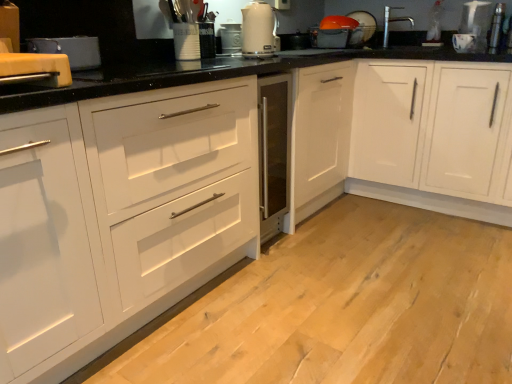
The image size is (512, 384). What are the coordinates of `white matte cabinet at center, the second cabinetry from the right` in the screenshot? It's located at (118, 216).

How much space does metallic silver toaster at center, placed as the third appliance when sorted from top to bottom, occupy horizontally?

metallic silver toaster at center, placed as the third appliance when sorted from top to bottom, is 3.46 inches in width.

How much space does matte black toaster at upper left, which is the 1th appliance from bottom to top, occupy horizontally?

9.72 inches.

Locate an element on the screen. matte black toaster at upper left, placed as the fourth appliance when sorted from right to left is located at coordinates (70, 50).

I want to click on matte white dish drainer at upper right, which appears as the fourth appliance when ordered from the bottom, so click(x=362, y=27).

Identify the location of silver metallic faucet at upper right. (392, 21).

Considering the sizes of objects white glossy cabinet at center, which is counted as the second cabinetry, starting from the left, and matte white dish drainer at upper right, which is the 1th appliance in back-to-front order, in the image provided, who is bigger, white glossy cabinet at center, which is counted as the second cabinetry, starting from the left, or matte white dish drainer at upper right, which is the 1th appliance in back-to-front order,?

white glossy cabinet at center, which is counted as the second cabinetry, starting from the left.

From a real-world perspective, is white glossy cabinet at center, which appears as the first cabinetry when viewed from the right, located higher than matte white dish drainer at upper right, the third appliance from the left?

No, from a real-world perspective, white glossy cabinet at center, which appears as the first cabinetry when viewed from the right, is not on top of matte white dish drainer at upper right, the third appliance from the left.

Is white glossy cabinet at center, which is counted as the second cabinetry, starting from the left, directly adjacent to matte white dish drainer at upper right, arranged as the second appliance when viewed from the right?

No, white glossy cabinet at center, which is counted as the second cabinetry, starting from the left, is not touching matte white dish drainer at upper right, arranged as the second appliance when viewed from the right.

Which of these two, white glossy cabinet at center, which is counted as the second cabinetry, starting from the left, or white matte cabinet at center, arranged as the first cabinetry when viewed from the left, stands taller?

white glossy cabinet at center, which is counted as the second cabinetry, starting from the left.

Considering the positions of objects white glossy cabinet at center, which is counted as the second cabinetry, starting from the left, and white matte cabinet at center, arranged as the first cabinetry when viewed from the left, in the image provided, who is more to the right, white glossy cabinet at center, which is counted as the second cabinetry, starting from the left, or white matte cabinet at center, arranged as the first cabinetry when viewed from the left,?

Positioned to the right is white glossy cabinet at center, which is counted as the second cabinetry, starting from the left.

Is white glossy cabinet at center, which is counted as the second cabinetry, starting from the left, positioned beyond the bounds of white matte cabinet at center, the second cabinetry from the right?

white glossy cabinet at center, which is counted as the second cabinetry, starting from the left, is positioned outside white matte cabinet at center, the second cabinetry from the right.

At what (x,y) coordinates should I click in order to perform the action: click on cabinetry located behind the white matte cabinet at center, arranged as the first cabinetry when viewed from the left. Please return your answer as a coordinate pair (x, y). Looking at the image, I should click on (434, 127).

Which of these two, matte black toaster at upper left, placed as the fourth appliance when sorted from right to left, or silver metallic faucet at upper right, is bigger?

silver metallic faucet at upper right.

Looking at this image, is matte black toaster at upper left, which is the 1th appliance from bottom to top, directly adjacent to silver metallic faucet at upper right?

matte black toaster at upper left, which is the 1th appliance from bottom to top, and silver metallic faucet at upper right are not in contact.

Which point is more forward, (x=90, y=63) or (x=388, y=38)?

The point (x=90, y=63) is in front.

Is matte black toaster at upper left, which is the 1th appliance from bottom to top, shorter than silver metallic faucet at upper right?

Indeed, matte black toaster at upper left, which is the 1th appliance from bottom to top, has a lesser height compared to silver metallic faucet at upper right.

Is white matte cabinet at center, the second cabinetry from the right, facing away from white glossy cabinet at center, which appears as the first cabinetry when viewed from the right?

No, white glossy cabinet at center, which appears as the first cabinetry when viewed from the right, is not at the back of white matte cabinet at center, the second cabinetry from the right.

Which of these two, white matte cabinet at center, arranged as the first cabinetry when viewed from the left, or white glossy cabinet at center, which appears as the first cabinetry when viewed from the right, is bigger?

white matte cabinet at center, arranged as the first cabinetry when viewed from the left.

Which is more to the left, white matte cabinet at center, arranged as the first cabinetry when viewed from the left, or white glossy cabinet at center, which appears as the first cabinetry when viewed from the right?

white matte cabinet at center, arranged as the first cabinetry when viewed from the left.

Is there a large distance between white matte cabinet at center, arranged as the first cabinetry when viewed from the left, and white glossy cabinet at center, which appears as the first cabinetry when viewed from the right?

white matte cabinet at center, arranged as the first cabinetry when viewed from the left, is positioned a significant distance from white glossy cabinet at center, which appears as the first cabinetry when viewed from the right.

Is matte white dish drainer at upper right, arranged as the second appliance when viewed from the right, beside metallic silver toaster at center, placed as the third appliance when sorted from top to bottom?

No, matte white dish drainer at upper right, arranged as the second appliance when viewed from the right, is not with metallic silver toaster at center, placed as the third appliance when sorted from top to bottom.

Is matte white dish drainer at upper right, placed as the 1th appliance when sorted from top to bottom, outside of metallic silver toaster at center, which is the 2th appliance in left-to-right order?

Yes, matte white dish drainer at upper right, placed as the 1th appliance when sorted from top to bottom, is located beyond the bounds of metallic silver toaster at center, which is the 2th appliance in left-to-right order.

Based on their positions, is matte white dish drainer at upper right, which appears as the fourth appliance when ordered from the bottom, located to the left or right of metallic silver toaster at center, which is the 2th appliance in left-to-right order?

matte white dish drainer at upper right, which appears as the fourth appliance when ordered from the bottom, is to the right of metallic silver toaster at center, which is the 2th appliance in left-to-right order.

Considering the relative sizes of matte white dish drainer at upper right, which appears as the 4th appliance when viewed from the front, and metallic silver toaster at center, which ranks as the second appliance in bottom-to-top order, in the image provided, is matte white dish drainer at upper right, which appears as the 4th appliance when viewed from the front, thinner than metallic silver toaster at center, which ranks as the second appliance in bottom-to-top order,?

Indeed, matte white dish drainer at upper right, which appears as the 4th appliance when viewed from the front, has a lesser width compared to metallic silver toaster at center, which ranks as the second appliance in bottom-to-top order.

Between white matte cabinet at center, the second cabinetry from the right, and metallic silver toaster at center, the 2th appliance viewed from the front, which one has less height?

metallic silver toaster at center, the 2th appliance viewed from the front, is shorter.

Would you say white matte cabinet at center, the second cabinetry from the right, is outside metallic silver toaster at center, placed as the third appliance when sorted from top to bottom?

white matte cabinet at center, the second cabinetry from the right, lies outside metallic silver toaster at center, placed as the third appliance when sorted from top to bottom,'s area.

Based on the photo, is the surface of white matte cabinet at center, arranged as the first cabinetry when viewed from the left, in direct contact with metallic silver toaster at center, the 2th appliance viewed from the front?

They are not placed beside each other.

From a real-world perspective, is matte white dish drainer at upper right, which appears as the 4th appliance when viewed from the front, physically below white matte cabinet at center, the second cabinetry from the right?

No, from a real-world perspective, matte white dish drainer at upper right, which appears as the 4th appliance when viewed from the front, is not below white matte cabinet at center, the second cabinetry from the right.

Considering the relative positions of matte white dish drainer at upper right, which is the 1th appliance in back-to-front order, and white matte cabinet at center, the second cabinetry from the right, in the image provided, is matte white dish drainer at upper right, which is the 1th appliance in back-to-front order, behind white matte cabinet at center, the second cabinetry from the right,?

Yes, it is behind white matte cabinet at center, the second cabinetry from the right.

Between matte white dish drainer at upper right, which appears as the 4th appliance when viewed from the front, and white matte cabinet at center, arranged as the first cabinetry when viewed from the left, which one has larger size?

Bigger between the two is white matte cabinet at center, arranged as the first cabinetry when viewed from the left.

Is matte white dish drainer at upper right, arranged as the second appliance when viewed from the right, not inside white matte cabinet at center, the second cabinetry from the right?

matte white dish drainer at upper right, arranged as the second appliance when viewed from the right, lies outside white matte cabinet at center, the second cabinetry from the right,'s area.

From the image's perspective, count 4th appliances upward from the white glossy cabinet at center, which appears as the first cabinetry when viewed from the right, and point to it. Please provide its 2D coordinates.

[(362, 27)]

At what (x,y) coordinates should I click in order to perform the action: click on cabinetry on the right side of white matte cabinet at center, the second cabinetry from the right. Please return your answer as a coordinate pair (x, y). Looking at the image, I should click on (434, 127).

Estimate the real-world distances between objects in this image. Which object is closer to matte black toaster at upper left, which is the 1th appliance from bottom to top, matte white dish drainer at upper right, which appears as the 4th appliance when viewed from the front, or white glossy cabinet at center, which is counted as the second cabinetry, starting from the left?

white glossy cabinet at center, which is counted as the second cabinetry, starting from the left.

When comparing their distances from silver metallic faucet at upper right, does white matte cabinet at center, arranged as the first cabinetry when viewed from the left, or white glossy electric kettle at upper center seem further?

white matte cabinet at center, arranged as the first cabinetry when viewed from the left, is further to silver metallic faucet at upper right.

Considering their positions, is white glossy cabinet at center, which appears as the first cabinetry when viewed from the right, positioned further to white matte cabinet at center, arranged as the first cabinetry when viewed from the left, than metallic silver toaster at upper right, the 2th appliance when ordered from back to front?

metallic silver toaster at upper right, the 2th appliance when ordered from back to front, is positioned further to the anchor white matte cabinet at center, arranged as the first cabinetry when viewed from the left.

When comparing their distances from metallic silver toaster at upper right, arranged as the 2th appliance when viewed from the top, does white matte cabinet at center, the second cabinetry from the right, or white glossy cabinet at center, which is counted as the second cabinetry, starting from the left, seem closer?

white glossy cabinet at center, which is counted as the second cabinetry, starting from the left, lies closer to metallic silver toaster at upper right, arranged as the 2th appliance when viewed from the top, than the other object.

Estimate the real-world distances between objects in this image. Which object is further from white matte cabinet at center, arranged as the first cabinetry when viewed from the left, metallic silver toaster at upper right, arranged as the 2th appliance when viewed from the top, or white glossy cabinet at center, which is counted as the second cabinetry, starting from the left?

The object further to white matte cabinet at center, arranged as the first cabinetry when viewed from the left, is metallic silver toaster at upper right, arranged as the 2th appliance when viewed from the top.

When comparing their distances from white glossy electric kettle at upper center, does metallic silver toaster at center, which is counted as the third appliance, starting from the back, or white glossy cabinet at center, which appears as the first cabinetry when viewed from the right, seem closer?

Among the two, metallic silver toaster at center, which is counted as the third appliance, starting from the back, is located nearer to white glossy electric kettle at upper center.

Considering their positions, is white glossy electric kettle at upper center positioned closer to metallic silver toaster at center, which is counted as the third appliance, starting from the back, than metallic silver toaster at upper right, which appears as the first appliance when viewed from the right?

Based on the image, white glossy electric kettle at upper center appears to be nearer to metallic silver toaster at center, which is counted as the third appliance, starting from the back.

From the image, which object appears to be nearer to white glossy cabinet at center, which appears as the first cabinetry when viewed from the right, white matte cabinet at center, arranged as the first cabinetry when viewed from the left, or metallic silver toaster at center, the 2th appliance viewed from the front?

metallic silver toaster at center, the 2th appliance viewed from the front, lies closer to white glossy cabinet at center, which appears as the first cabinetry when viewed from the right, than the other object.

Identify the location of faucet located between white glossy electric kettle at upper center and metallic silver toaster at upper right, which is counted as the fourth appliance, starting from the left, in the left-right direction. This screenshot has width=512, height=384. (392, 21).

At what (x,y) coordinates should I click in order to perform the action: click on faucet between matte black toaster at upper left, which is the 1th appliance from bottom to top, and metallic silver toaster at upper right, which appears as the first appliance when viewed from the right, from left to right. Please return your answer as a coordinate pair (x, y). The height and width of the screenshot is (384, 512). Looking at the image, I should click on (392, 21).

This screenshot has height=384, width=512. What are the coordinates of `kitchen appliance between metallic silver toaster at center, placed as the third appliance when sorted from top to bottom, and metallic silver toaster at upper right, the 3th appliance in the front-to-back sequence, in the horizontal direction` in the screenshot? It's located at (258, 30).

This screenshot has height=384, width=512. What are the coordinates of `kitchen appliance between matte black toaster at upper left, which appears as the 1th appliance when viewed from the front, and matte white dish drainer at upper right, which is the 1th appliance in back-to-front order, in the front-back direction` in the screenshot? It's located at (258, 30).